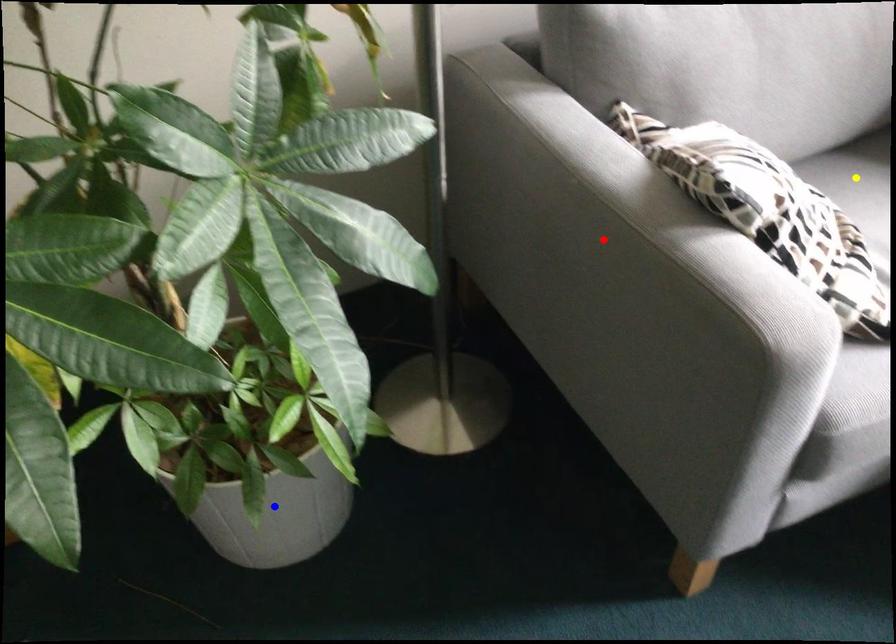
Order these from nearest to farthest:
red point
blue point
yellow point

red point → blue point → yellow point